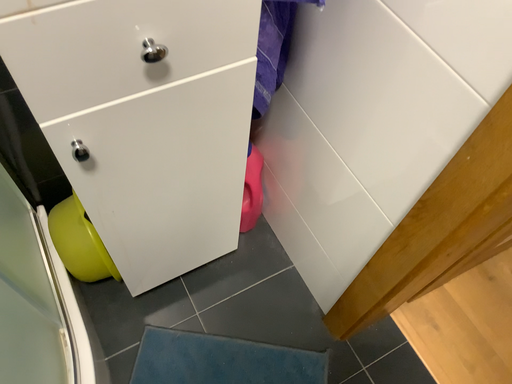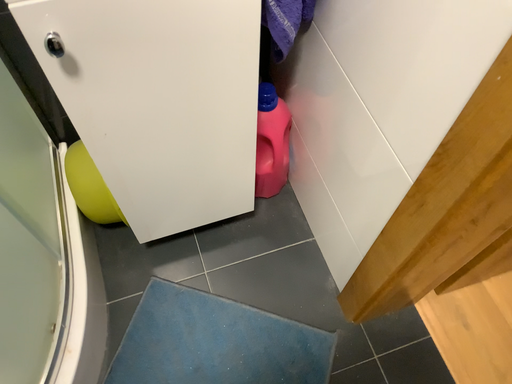
Question: Which way did the camera rotate in the video?

Choices:
 (A) rotated right
 (B) rotated left

Answer: (B)